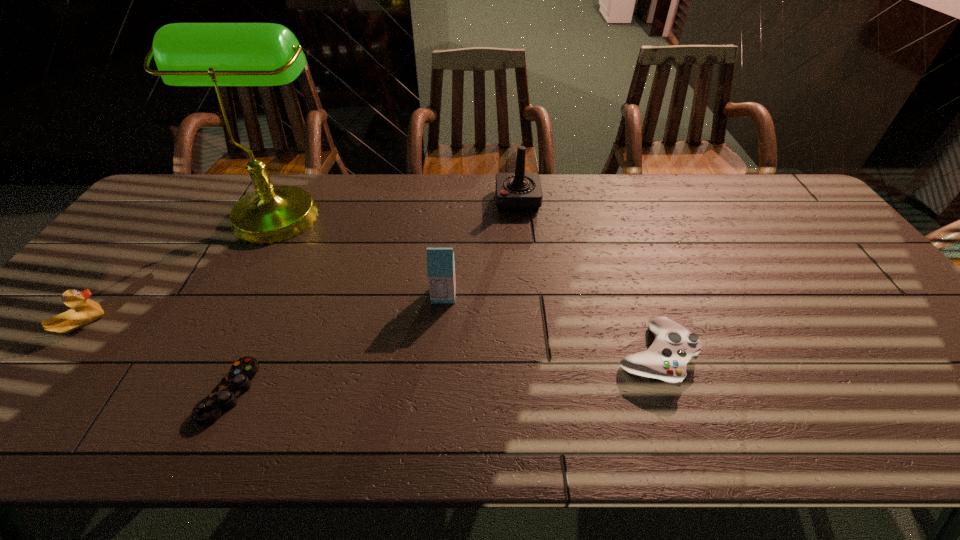
Where is `the left control`? Image resolution: width=960 pixels, height=540 pixels. the left control is located at coordinates (224, 396).

Find the location of `free region located on the desk next to the lamp`. free region located on the desk next to the lamp is located at coordinates (395, 211).

At what (x,y) coordinates should I click in order to perform the action: click on free space located on the front-facing side of the joystick. Please return your answer as a coordinate pair (x, y). The image size is (960, 540). Looking at the image, I should click on (466, 201).

Identify the location of vacant area situated 0.210m on the front-facing side of the joystick. The height and width of the screenshot is (540, 960). (432, 201).

The height and width of the screenshot is (540, 960). I want to click on vacant space situated on the front-facing side of the joystick, so click(466, 201).

This screenshot has width=960, height=540. In order to click on vacant region located 0.270m on the front of the milk carton in this screenshot , I will do point(436,397).

The image size is (960, 540). Find the location of `vacant area located 0.190m at the beak of the fourth tallest object`. vacant area located 0.190m at the beak of the fourth tallest object is located at coordinates (180, 324).

Image resolution: width=960 pixels, height=540 pixels. Find the location of `vacant region located 0.390m on the left of the right control`. vacant region located 0.390m on the left of the right control is located at coordinates (447, 356).

Where is `vacant region located on the right of the shorter control`? This screenshot has width=960, height=540. vacant region located on the right of the shorter control is located at coordinates (278, 392).

Find the location of a particular element. lamp that is at the far edge is located at coordinates (187, 54).